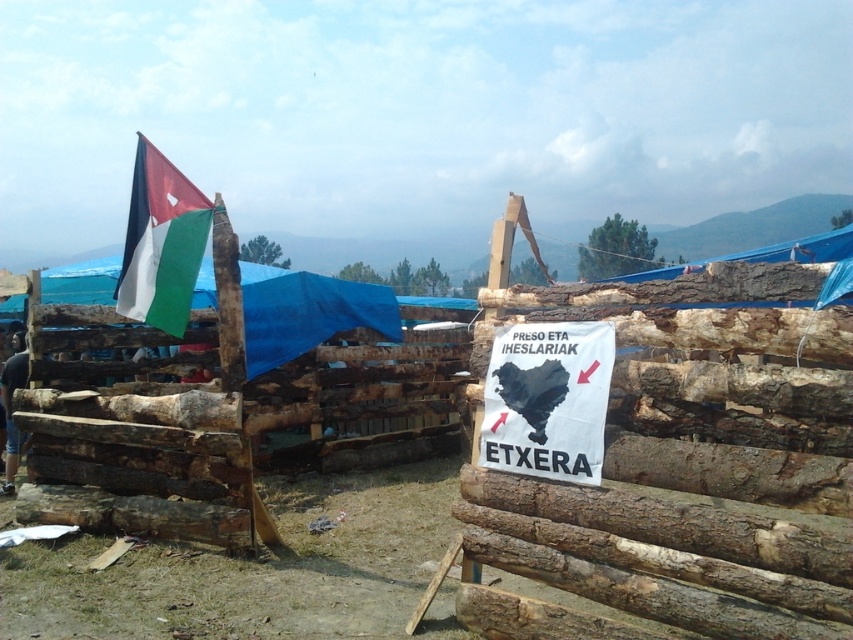
Can you confirm if matte fabric flag at upper left is positioned below dark blue jeans at left?

No.

This screenshot has width=853, height=640. In order to click on matte fabric flag at upper left in this screenshot , I will do `click(161, 243)`.

This screenshot has height=640, width=853. Identify the location of matte fabric flag at upper left. (161, 243).